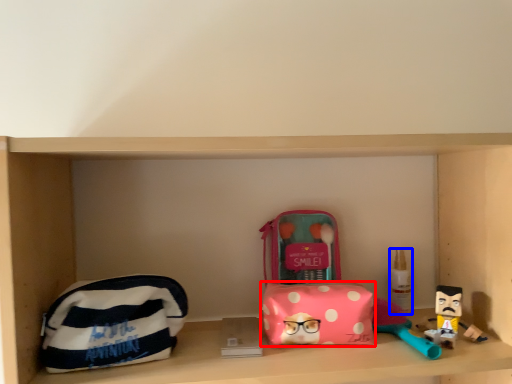
Question: Which point is closer to the camera, pouch (highlighted by a red box) or toiletry (highlighted by a blue box)?

Choices:
 (A) pouch
 (B) toiletry

Answer: (A)